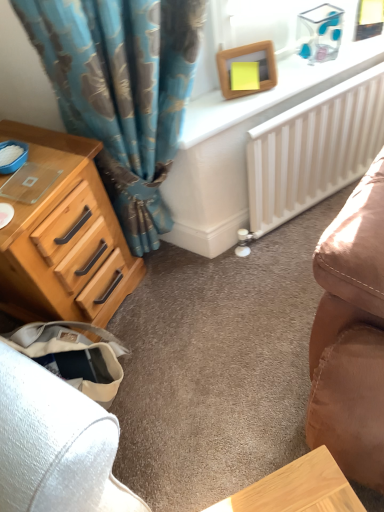
Question: From a real-world perspective, is white matte radiator at center-right positioned under wooden picture frame at upper center based on gravity?

Choices:
 (A) yes
 (B) no

Answer: (A)

Question: Is white matte radiator at center-right shorter than wooden picture frame at upper center?

Choices:
 (A) yes
 (B) no

Answer: (B)

Question: Considering the relative sizes of white matte radiator at center-right and wooden picture frame at upper center in the image provided, is white matte radiator at center-right smaller than wooden picture frame at upper center?

Choices:
 (A) yes
 (B) no

Answer: (B)

Question: Is white matte radiator at center-right positioned far away from wooden picture frame at upper center?

Choices:
 (A) yes
 (B) no

Answer: (B)

Question: From the image's perspective, is white matte radiator at center-right on top of wooden picture frame at upper center?

Choices:
 (A) yes
 (B) no

Answer: (B)

Question: Does point (253, 60) appear closer or farther from the camera than point (359, 134)?

Choices:
 (A) closer
 (B) farther

Answer: (A)

Question: Considering the relative positions of wooden picture frame at upper center and white matte radiator at center-right in the image provided, is wooden picture frame at upper center to the left or to the right of white matte radiator at center-right?

Choices:
 (A) right
 (B) left

Answer: (B)

Question: Considering their positions, is wooden picture frame at upper center located in front of or behind white matte radiator at center-right?

Choices:
 (A) front
 (B) behind

Answer: (A)

Question: Do you think wooden picture frame at upper center is within white matte radiator at center-right, or outside of it?

Choices:
 (A) inside
 (B) outside

Answer: (B)

Question: From a real-world perspective, is white matte radiator at center-right physically located above or below wooden picture frame at upper center?

Choices:
 (A) above
 (B) below

Answer: (B)

Question: Would you say white matte radiator at center-right is to the left or to the right of wooden picture frame at upper center in the picture?

Choices:
 (A) right
 (B) left

Answer: (A)

Question: Is white matte radiator at center-right taller or shorter than wooden picture frame at upper center?

Choices:
 (A) short
 (B) tall

Answer: (B)

Question: Considering their positions, is white matte radiator at center-right located in front of or behind wooden picture frame at upper center?

Choices:
 (A) behind
 (B) front

Answer: (A)

Question: Is wooden picture frame at upper center taller or shorter than light brown wood chest of drawers at left?

Choices:
 (A) tall
 (B) short

Answer: (B)

Question: Considering their positions, is wooden picture frame at upper center located in front of or behind light brown wood chest of drawers at left?

Choices:
 (A) front
 (B) behind

Answer: (B)